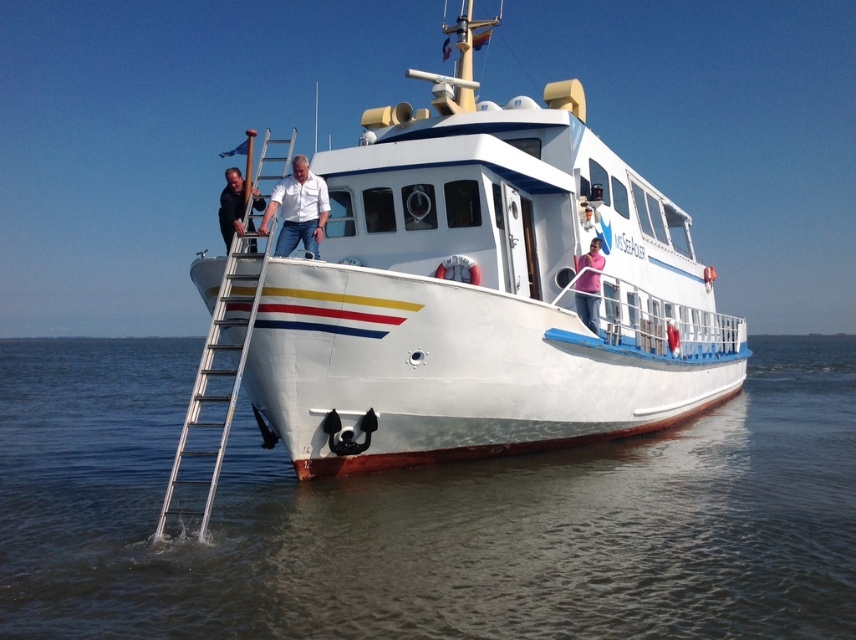
Question: Based on their relative distances, which object is farther from the pink fabric shirt at upper right?

Choices:
 (A) white matte shirt at center
 (B) black leather jacket at upper center
 (C) silver metallic ladder at left
 (D) white glossy boat at center

Answer: (C)

Question: Which point appears farthest from the camera in this image?

Choices:
 (A) (577, 284)
 (B) (236, 356)
 (C) (456, 243)
 (D) (516, 525)

Answer: (A)

Question: Which object is farther from the camera taking this photo?

Choices:
 (A) pink fabric shirt at upper right
 (B) silver metallic ladder at left

Answer: (A)

Question: Is brown water at lower left to the right of white matte shirt at center from the viewer's perspective?

Choices:
 (A) no
 (B) yes

Answer: (A)

Question: Can you confirm if white glossy boat at center is positioned to the right of black leather jacket at upper center?

Choices:
 (A) yes
 (B) no

Answer: (A)

Question: Is white matte shirt at center below pink fabric shirt at upper right?

Choices:
 (A) no
 (B) yes

Answer: (A)